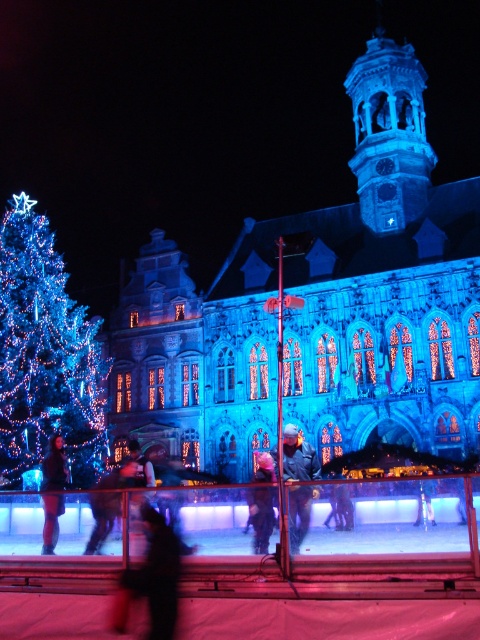
You are an event organizer planning to place a decorative banner above the silhouette fabric person at center and the dark blue fabric jacket at center. Which object should the banner be placed above to ensure it is visible over both?

The banner should be placed above the dark blue fabric jacket at center since the silhouette fabric person at center is positioned under it, ensuring visibility over both objects.

You are standing in the public square and want to know which of the two points, point (179, 544) or point (251, 500), is closer to you. Can you determine this based on their positions?

Point (179, 544) is closer to the viewer than point (251, 500), so the first point is closer to you.

You are planning to install a new lighting fixture between the silhouette fabric person at center and the grand ornate building. The fixture requires a minimum of 120 feet of space between the person and the building to function properly. Based on the scene description, will the existing distance allow this installation?

The silhouette fabric person at center and the grand ornate building are 130.46 feet apart, which exceeds the required 120 feet. Therefore, the lighting fixture can be installed between them as the distance is sufficient.